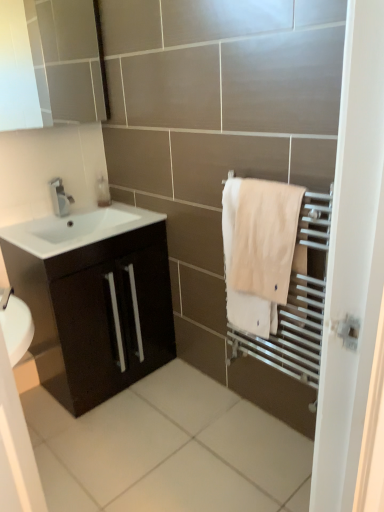
Question: Is translucent plastic soap dispenser at upper left with white glossy medicine cabinet at upper left?

Choices:
 (A) no
 (B) yes

Answer: (A)

Question: Is white glossy medicine cabinet at upper left a part of translucent plastic soap dispenser at upper left?

Choices:
 (A) yes
 (B) no

Answer: (B)

Question: Considering the relative sizes of translucent plastic soap dispenser at upper left and white glossy medicine cabinet at upper left in the image provided, is translucent plastic soap dispenser at upper left bigger than white glossy medicine cabinet at upper left?

Choices:
 (A) yes
 (B) no

Answer: (B)

Question: From the image's perspective, is translucent plastic soap dispenser at upper left located above white glossy medicine cabinet at upper left?

Choices:
 (A) no
 (B) yes

Answer: (A)

Question: Can you confirm if translucent plastic soap dispenser at upper left is positioned to the left of white glossy medicine cabinet at upper left?

Choices:
 (A) no
 (B) yes

Answer: (A)

Question: Is translucent plastic soap dispenser at upper left shorter than white glossy medicine cabinet at upper left?

Choices:
 (A) yes
 (B) no

Answer: (A)

Question: Is the position of matte dark brown cabinet at left less distant than that of satin nickel faucet at upper left?

Choices:
 (A) no
 (B) yes

Answer: (B)

Question: Does matte dark brown cabinet at left have a smaller size compared to satin nickel faucet at upper left?

Choices:
 (A) no
 (B) yes

Answer: (A)

Question: Is matte dark brown cabinet at left to the right of satin nickel faucet at upper left from the viewer's perspective?

Choices:
 (A) yes
 (B) no

Answer: (A)

Question: From the image's perspective, is matte dark brown cabinet at left on satin nickel faucet at upper left?

Choices:
 (A) yes
 (B) no

Answer: (B)

Question: Would you say matte dark brown cabinet at left is outside satin nickel faucet at upper left?

Choices:
 (A) yes
 (B) no

Answer: (A)

Question: Considering the relative sizes of matte dark brown cabinet at left and satin nickel faucet at upper left in the image provided, is matte dark brown cabinet at left taller than satin nickel faucet at upper left?

Choices:
 (A) yes
 (B) no

Answer: (A)

Question: From the image's perspective, is white glossy sink at lower left located beneath satin nickel faucet at upper left?

Choices:
 (A) no
 (B) yes

Answer: (B)